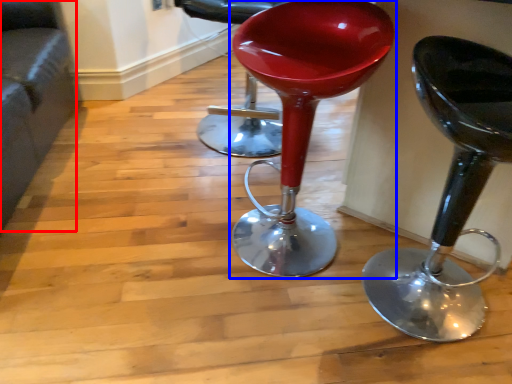
Question: Which object is further to the camera taking this photo, couch (highlighted by a red box) or stool (highlighted by a blue box)?

Choices:
 (A) couch
 (B) stool

Answer: (B)